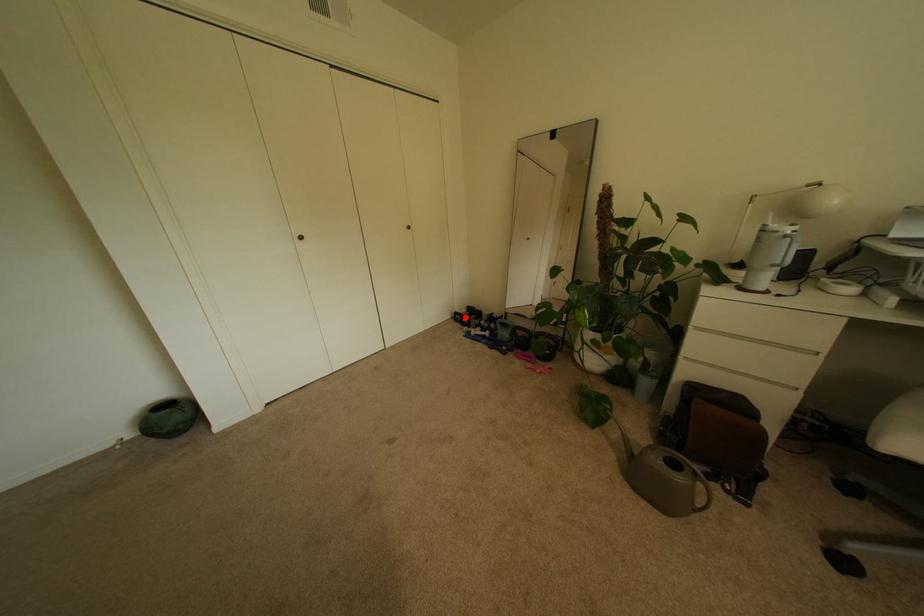
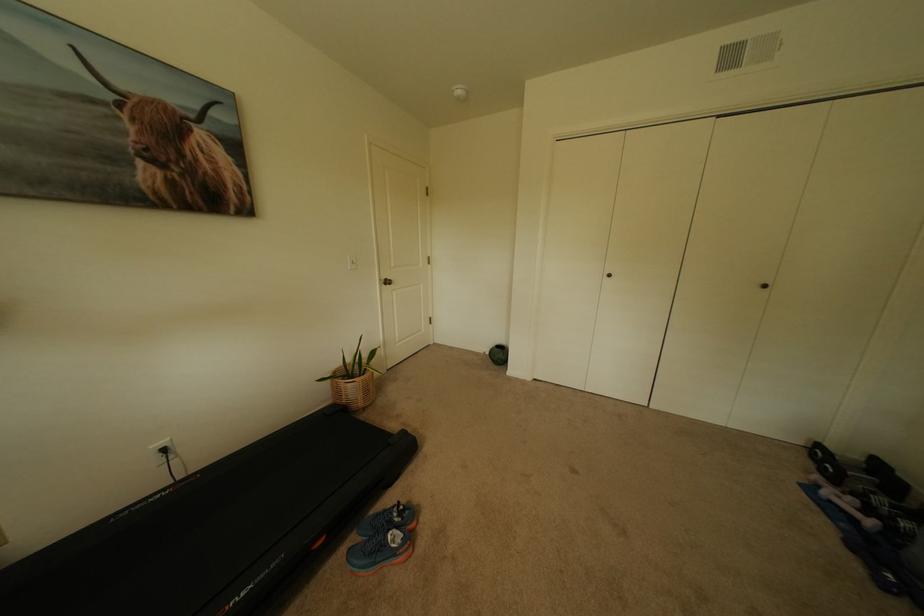
The point at the highlighted location is marked in the first image. Where is the corresponding point in the second image?

(827, 452)